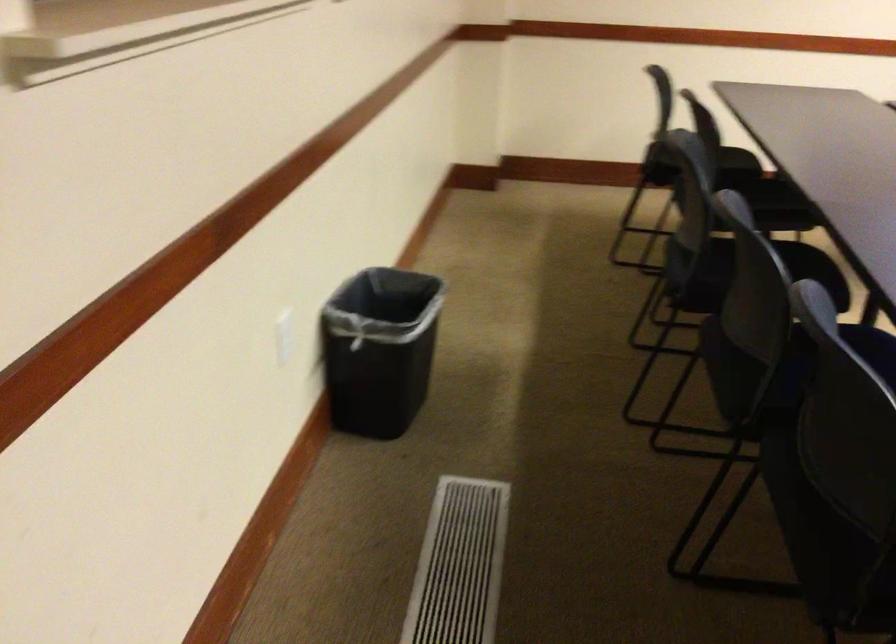
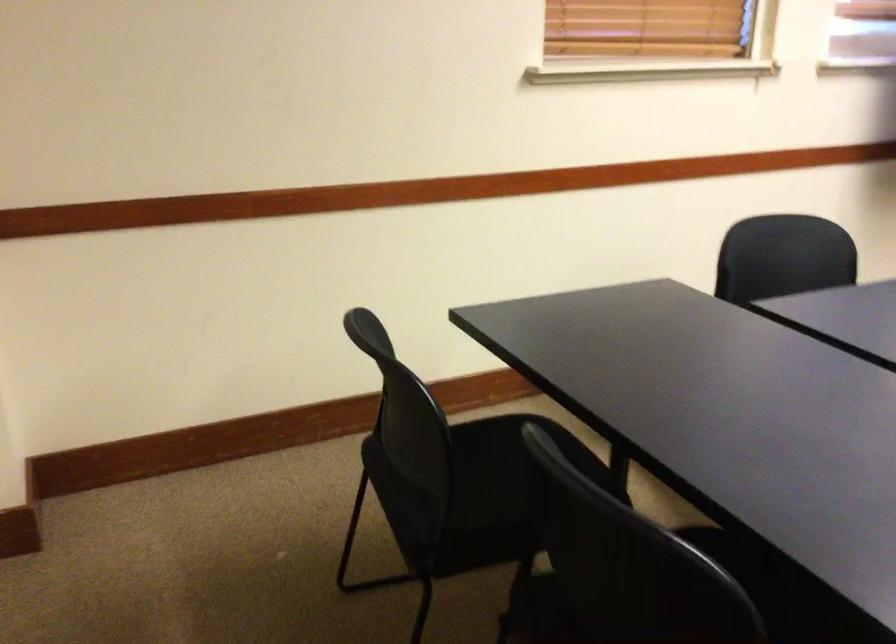
First-person continuous shooting, in which direction is the camera rotating?

The rotation direction of the camera is right-down.